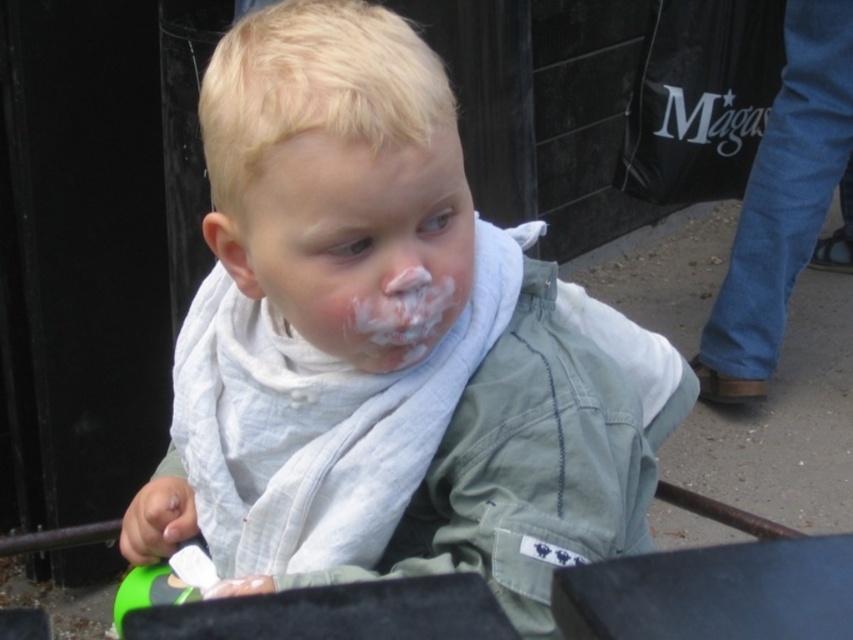
Question: Is white matte scarf at center bigger than white creamy frosting at center?

Choices:
 (A) yes
 (B) no

Answer: (A)

Question: Among these objects, which one is farthest from the camera?

Choices:
 (A) light green fabric shirt at center
 (B) white creamy frosting at center
 (C) white matte scarf at center

Answer: (B)

Question: Among these objects, which one is farthest from the camera?

Choices:
 (A) white creamy frosting at center
 (B) white matte scarf at center

Answer: (A)

Question: Is light green fabric shirt at center thinner than white matte scarf at center?

Choices:
 (A) no
 (B) yes

Answer: (A)

Question: Considering the real-world distances, which object is closest to the light green fabric shirt at center?

Choices:
 (A) white matte scarf at center
 (B) white creamy frosting at center

Answer: (A)

Question: Can you confirm if light green fabric shirt at center is thinner than white creamy frosting at center?

Choices:
 (A) yes
 (B) no

Answer: (B)